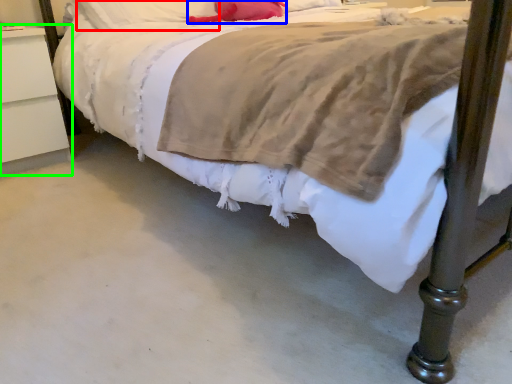
Question: Which object is the farthest from pillow (highlighted by a red box)? Choose among these: pillow (highlighted by a blue box) or nightstand (highlighted by a green box).

Choices:
 (A) pillow
 (B) nightstand

Answer: (B)